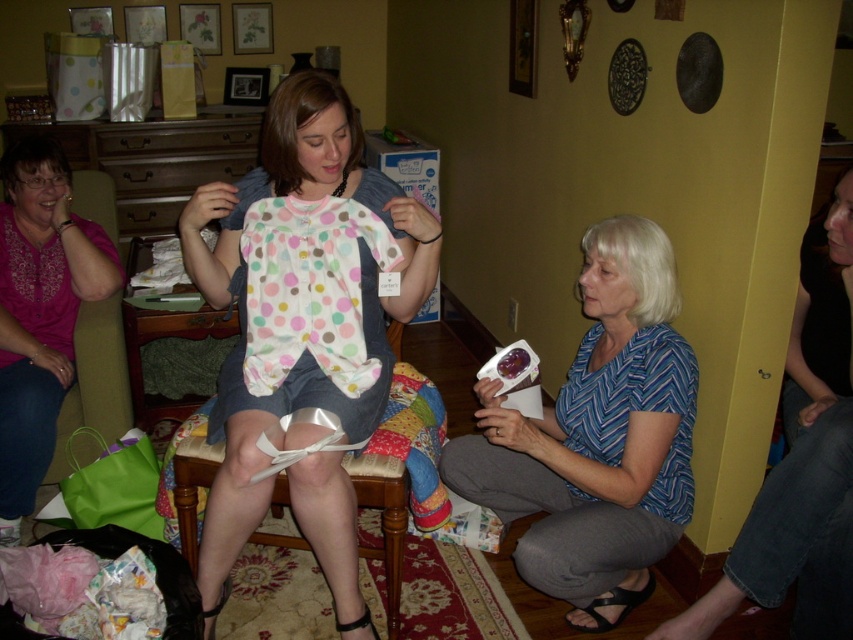
You are organizing a baby clothing display and need to arrange the matte polka dot onesie at center and the blue chevron shirt at lower right. According to the image, which clothing item is positioned closer to the front?

Result: The matte polka dot onesie at center is positioned closer to the front because the blue chevron shirt at lower right is behind it.